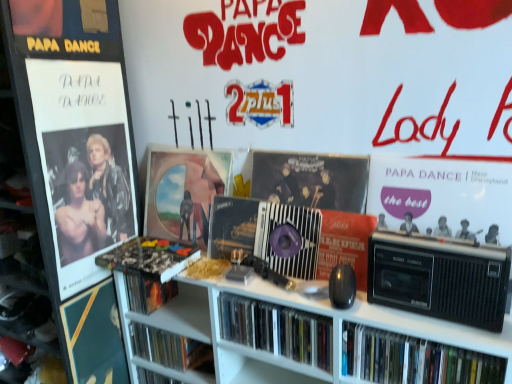
What is the approximate height of black plastic radio at right, which is the 1th book from right to left?

The height of black plastic radio at right, which is the 1th book from right to left, is 5.19 inches.

Describe the element at coordinates (266, 234) in the screenshot. I see `metallic silver cassette at center, which is the 2th cassette in right-to-left order` at that location.

This screenshot has height=384, width=512. Describe the element at coordinates (83, 163) in the screenshot. I see `metallic glossy poster at left` at that location.

This screenshot has width=512, height=384. Describe the element at coordinates (298, 309) in the screenshot. I see `white plastic bookcase at center` at that location.

You are a GUI agent. You are given a task and a screenshot of the screen. Output one action in this format:
    pyautogui.click(x=<x>, y=<y>)
    Task: Click on the white plastic bookcase at center
    
    Given the screenshot: What is the action you would take?
    pyautogui.click(x=298, y=309)

Locate an element on the screen. The image size is (512, 384). black plastic radio at right, the 4th book from the left is located at coordinates (413, 359).

What's the angular difference between matte black record player at right and camouflage-patterned book at center, arranged as the 2th book when viewed from the left,'s facing directions?

They differ by 0.00028 degrees in their facing directions.

Identify the location of the 1st book below the matte black record player at right (from the image's perspective). (150, 257).

From the image's perspective, is matte black record player at right below camouflage-patterned book at center, placed as the third book when sorted from right to left?

Actually, matte black record player at right appears above camouflage-patterned book at center, placed as the third book when sorted from right to left, in the image.

Is point (452, 203) closer to viewer compared to point (470, 254)?

No, (452, 203) is behind (470, 254).

Which cassette is the 1st one when counting from the left side of the matte black record player at right? Please provide its 2D coordinates.

[(439, 278)]

Can you tell me how much matte black record player at right and black plastic cassette at right, which is the second cassette in left-to-right order, differ in facing direction?

The facing directions of matte black record player at right and black plastic cassette at right, which is the second cassette in left-to-right order, are 0.00017 degrees apart.

Consider the image. Does matte black record player at right have a greater height compared to black plastic cassette at right, which is the second cassette in left-to-right order?

Indeed, matte black record player at right has a greater height compared to black plastic cassette at right, which is the second cassette in left-to-right order.

From a real-world perspective, is black plastic radio at right, which is the 1th book from right to left, beneath matte vinyl record at center?

Indeed, from a real-world perspective, black plastic radio at right, which is the 1th book from right to left, is positioned beneath matte vinyl record at center.

Is black plastic radio at right, the 4th book from the left, far from matte vinyl record at center?

Actually, black plastic radio at right, the 4th book from the left, and matte vinyl record at center are a little close together.

Where is `poster page located behind the black plastic radio at right, which is the 1th book from right to left`? The width and height of the screenshot is (512, 384). poster page located behind the black plastic radio at right, which is the 1th book from right to left is located at coordinates (184, 191).

Does black plastic radio at right, the 4th book from the left, have a lesser width compared to matte vinyl record at center?

In fact, black plastic radio at right, the 4th book from the left, might be wider than matte vinyl record at center.

Can you confirm if metallic glossy poster at left is wider than camouflage-patterned book at center, arranged as the 2th book when viewed from the left?

No.

From the picture: Which is more to the left, metallic glossy poster at left or camouflage-patterned book at center, arranged as the 2th book when viewed from the left?

metallic glossy poster at left.

Choose the correct answer: Is metallic glossy poster at left inside camouflage-patterned book at center, placed as the third book when sorted from right to left, or outside it?

metallic glossy poster at left is not enclosed by camouflage-patterned book at center, placed as the third book when sorted from right to left.

Is matte black cd case at center, which ranks as the second book in right-to-left order, placed right next to matte black book at center, placed as the fourth book when sorted from right to left?

matte black cd case at center, which ranks as the second book in right-to-left order, and matte black book at center, placed as the fourth book when sorted from right to left, are not in contact.

Between matte black cd case at center, which ranks as the second book in right-to-left order, and matte black book at center, acting as the first book starting from the left, which one is positioned behind?

matte black book at center, acting as the first book starting from the left, is more distant.

From the image's perspective, which object appears higher, matte black cd case at center, which ranks as the second book in right-to-left order, or matte black book at center, placed as the fourth book when sorted from right to left?

From the image's view, matte black book at center, placed as the fourth book when sorted from right to left, is above.

Is matte black book at center, placed as the fourth book when sorted from right to left, surrounded by matte black cd case at center, which ranks as the second book in right-to-left order?

No, matte black book at center, placed as the fourth book when sorted from right to left, is located outside of matte black cd case at center, which ranks as the second book in right-to-left order.

Can you confirm if metallic silver cassette at center, which is the 2th cassette in right-to-left order, is positioned to the right of white plastic bookcase at center?

No.

Could you tell me if metallic silver cassette at center, which appears as the 2th cassette when viewed from the front, is facing white plastic bookcase at center?

No, metallic silver cassette at center, which appears as the 2th cassette when viewed from the front, does not turn towards white plastic bookcase at center.

From their relative heights in the image, would you say metallic silver cassette at center, which appears as the 2th cassette when viewed from the front, is taller or shorter than white plastic bookcase at center?

Considering their sizes, metallic silver cassette at center, which appears as the 2th cassette when viewed from the front, has less height than white plastic bookcase at center.

From the image's perspective, which one is positioned higher, metallic silver cassette at center, the 1th cassette viewed from the left, or white plastic bookcase at center?

metallic silver cassette at center, the 1th cassette viewed from the left, from the image's perspective.

Is black plastic radio at right, the 4th book from the left, to the right of metallic glossy poster at left from the viewer's perspective?

Correct, you'll find black plastic radio at right, the 4th book from the left, to the right of metallic glossy poster at left.

Is black plastic radio at right, the 4th book from the left, in contact with metallic glossy poster at left?

No, black plastic radio at right, the 4th book from the left, is not making contact with metallic glossy poster at left.

Does point (482, 356) lie in front of point (68, 262)?

Yes.

From a real-world perspective, is black plastic radio at right, the 4th book from the left, on metallic glossy poster at left?

No, from a real-world perspective, black plastic radio at right, the 4th book from the left, is not on top of metallic glossy poster at left.

At what (x,y) coordinates should I click in order to perform the action: click on movie poster in front of the camouflage-patterned book at center, arranged as the 2th book when viewed from the left. Please return your answer as a coordinate pair (x, y). The height and width of the screenshot is (384, 512). Looking at the image, I should click on (442, 197).

Image resolution: width=512 pixels, height=384 pixels. Find the location of `the 2nd cassette positioned below the matte black record player at right (from the image's perspective)`. the 2nd cassette positioned below the matte black record player at right (from the image's perspective) is located at coordinates (439, 278).

Estimate the real-world distances between objects in this image. Which object is further from white plastic bookcase at center, black plastic cassette at right, which appears as the 1th cassette when viewed from the right, or matte black book at center, acting as the first book starting from the left?

The object further to white plastic bookcase at center is matte black book at center, acting as the first book starting from the left.

Based on the photo, considering their positions, is matte vinyl record at center positioned further to metallic glossy poster at left than matte black book at center, acting as the first book starting from the left?

The object further to metallic glossy poster at left is matte black book at center, acting as the first book starting from the left.

When comparing their distances from camouflage-patterned book at center, arranged as the 2th book when viewed from the left, does metallic glossy poster at left or matte vinyl record at center seem further?

Among the two, metallic glossy poster at left is located further to camouflage-patterned book at center, arranged as the 2th book when viewed from the left.

Estimate the real-world distances between objects in this image. Which object is closer to matte black record player at right, metallic glossy poster at left or black plastic cassette at right, the second cassette when ordered from back to front?

Among the two, black plastic cassette at right, the second cassette when ordered from back to front, is located nearer to matte black record player at right.

Estimate the real-world distances between objects in this image. Which object is further from matte black cd case at center, which ranks as the second book in right-to-left order, matte black book at center, acting as the first book starting from the left, or matte black record player at right?

The object further to matte black cd case at center, which ranks as the second book in right-to-left order, is matte black book at center, acting as the first book starting from the left.

From the image, which object appears to be farther from matte vinyl record at center, black plastic cassette at right, which appears as the 1th cassette when viewed from the right, or metallic silver cassette at center, the 1th cassette viewed from the left?

black plastic cassette at right, which appears as the 1th cassette when viewed from the right.

When comparing their distances from white plastic bookcase at center, does camouflage-patterned book at center, arranged as the 2th book when viewed from the left, or matte black book at center, acting as the first book starting from the left, seem further?

matte black book at center, acting as the first book starting from the left.

Consider the image. Estimate the real-world distances between objects in this image. Which object is further from matte black book at center, acting as the first book starting from the left, matte vinyl record at center or metallic silver cassette at center, which appears as the 2th cassette when viewed from the front?

The object further to matte black book at center, acting as the first book starting from the left, is metallic silver cassette at center, which appears as the 2th cassette when viewed from the front.

Locate an element on the screen. The height and width of the screenshot is (384, 512). poster page situated between matte black book at center, placed as the fourth book when sorted from right to left, and black plastic radio at right, which is the 1th book from right to left, from left to right is located at coordinates (184, 191).

Image resolution: width=512 pixels, height=384 pixels. Find the location of `book between camouflage-patterned book at center, arranged as the 2th book when viewed from the left, and black plastic cassette at right, which appears as the 1th cassette when viewed from the right`. book between camouflage-patterned book at center, arranged as the 2th book when viewed from the left, and black plastic cassette at right, which appears as the 1th cassette when viewed from the right is located at coordinates (277, 329).

Locate an element on the screen. bookcase located between camouflage-patterned book at center, arranged as the 2th book when viewed from the left, and black plastic radio at right, the 4th book from the left, in the left-right direction is located at coordinates tap(298, 309).

You are a GUI agent. You are given a task and a screenshot of the screen. Output one action in this format:
    pyautogui.click(x=<x>, y=<y>)
    Task: Click on the poster page between matte black book at center, placed as the fourth book when sorted from right to left, and matte black record player at right, in the horizontal direction
    The height and width of the screenshot is (384, 512).
    Given the screenshot: What is the action you would take?
    pyautogui.click(x=184, y=191)